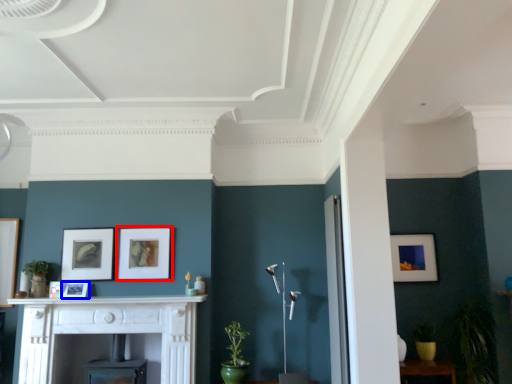
Question: Which object appears farthest to the camera in this image, picture frame (highlighted by a red box) or picture frame (highlighted by a blue box)?

Choices:
 (A) picture frame
 (B) picture frame

Answer: (A)